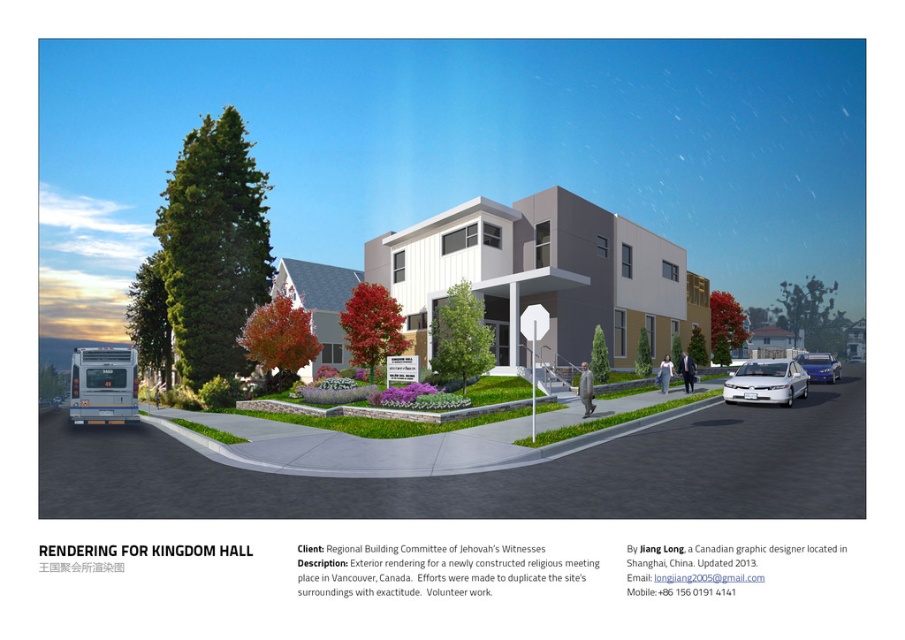
How far apart are silver metallic bus at lower left and white glossy sedan at right?

33.87 meters

Between point (116, 392) and point (823, 362), which one is positioned in front?

Point (116, 392) is more forward.

This screenshot has width=905, height=640. Find the location of `silver metallic bus at lower left`. silver metallic bus at lower left is located at coordinates (103, 385).

Locate an element on the screen. The height and width of the screenshot is (640, 905). white glossy sedan at lower right is located at coordinates [x=767, y=381].

Can you confirm if white glossy sedan at lower right is shorter than white glossy sedan at right?

No, white glossy sedan at lower right is not shorter than white glossy sedan at right.

Who is more distant from viewer, [797,372] or [836,372]?

The point [836,372] is more distant.

This screenshot has width=905, height=640. I want to click on white glossy sedan at lower right, so click(767, 381).

Is silver metallic bus at lower left shorter than white glossy sedan at lower right?

No.

Between silver metallic bus at lower left and white glossy sedan at lower right, which one has less height?

Standing shorter between the two is white glossy sedan at lower right.

Between point (110, 422) and point (767, 394), which one is positioned in front?

Point (767, 394) is in front.

Where is `silver metallic bus at lower left`? This screenshot has width=905, height=640. silver metallic bus at lower left is located at coordinates (103, 385).